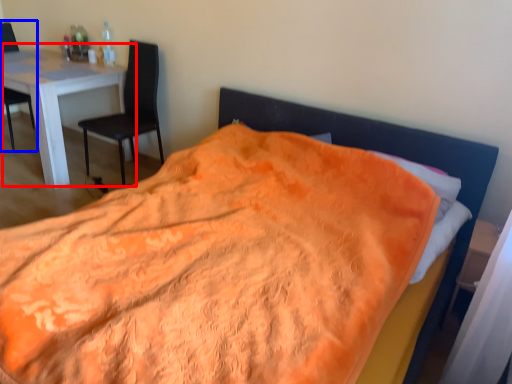
Question: Among these objects, which one is farthest to the camera, table (highlighted by a red box) or chair (highlighted by a blue box)?

Choices:
 (A) table
 (B) chair

Answer: (B)